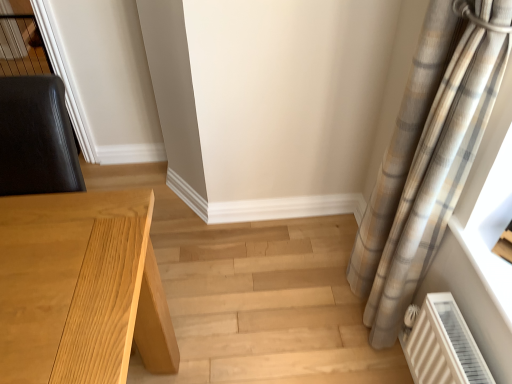
Question: Is point (11, 281) positioned closer to the camera than point (416, 147)?

Choices:
 (A) closer
 (B) farther

Answer: (A)

Question: Is light wood table at left to the left or to the right of plaid fabric curtain at right in the image?

Choices:
 (A) right
 (B) left

Answer: (B)

Question: Considering their positions, is light wood table at left located in front of or behind plaid fabric curtain at right?

Choices:
 (A) front
 (B) behind

Answer: (A)

Question: From a real-world perspective, is plaid fabric curtain at right physically located above or below light wood table at left?

Choices:
 (A) below
 (B) above

Answer: (B)

Question: Considering the positions of plaid fabric curtain at right and light wood table at left in the image, is plaid fabric curtain at right taller or shorter than light wood table at left?

Choices:
 (A) tall
 (B) short

Answer: (A)

Question: Does point (379, 345) appear closer or farther from the camera than point (138, 284)?

Choices:
 (A) closer
 (B) farther

Answer: (B)

Question: From the image's perspective, is plaid fabric curtain at right positioned above or below light wood table at left?

Choices:
 (A) above
 (B) below

Answer: (A)